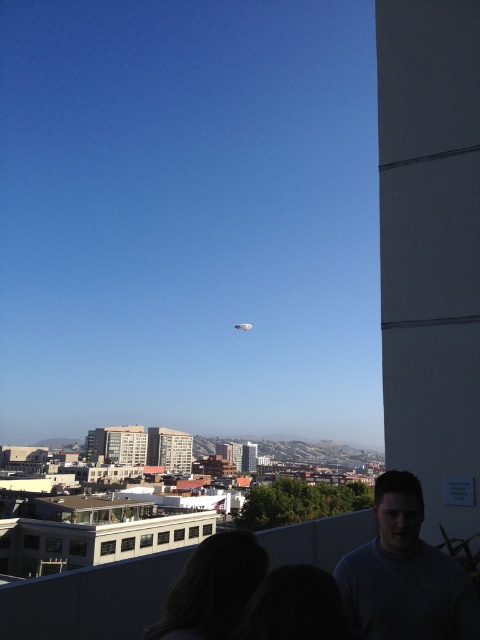
Question: Which point is closer to the camera?

Choices:
 (A) dark hair at lower left
 (B) dark gray sweater at lower right

Answer: (B)

Question: Is dark gray sweater at lower right bigger than dark hair at lower left?

Choices:
 (A) yes
 (B) no

Answer: (A)

Question: Is dark gray sweater at lower right smaller than dark hair at lower left?

Choices:
 (A) yes
 (B) no

Answer: (B)

Question: Among these points, which one is farthest from the camera?

Choices:
 (A) (237, 605)
 (B) (391, 593)

Answer: (B)

Question: Observing the image, what is the correct spatial positioning of dark gray sweater at lower right in reference to dark hair at lower left?

Choices:
 (A) above
 (B) below

Answer: (A)